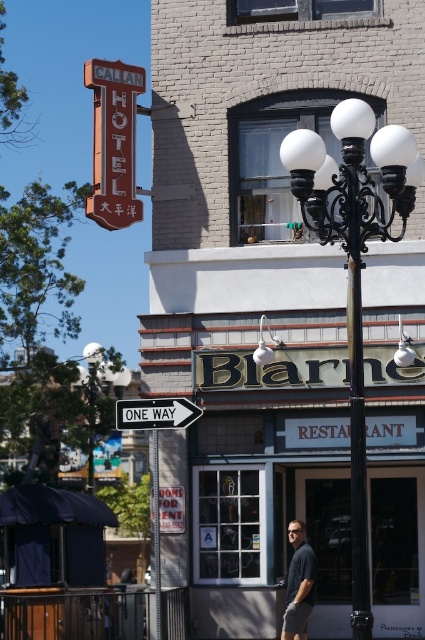
You are a pedestrian standing on the street looking at the scene. You see the blue denim jeans at lower center and the white plastic one way sign at center. Which object appears smaller in the image?

The blue denim jeans at lower center appears smaller than the white plastic one way sign at center according to the description.

You are a city planner assessing the street layout. You notice the white glass streetlight at center and the white glass lamp at center. Which one is taller?

The white glass streetlight at center is much taller than the white glass lamp at center.